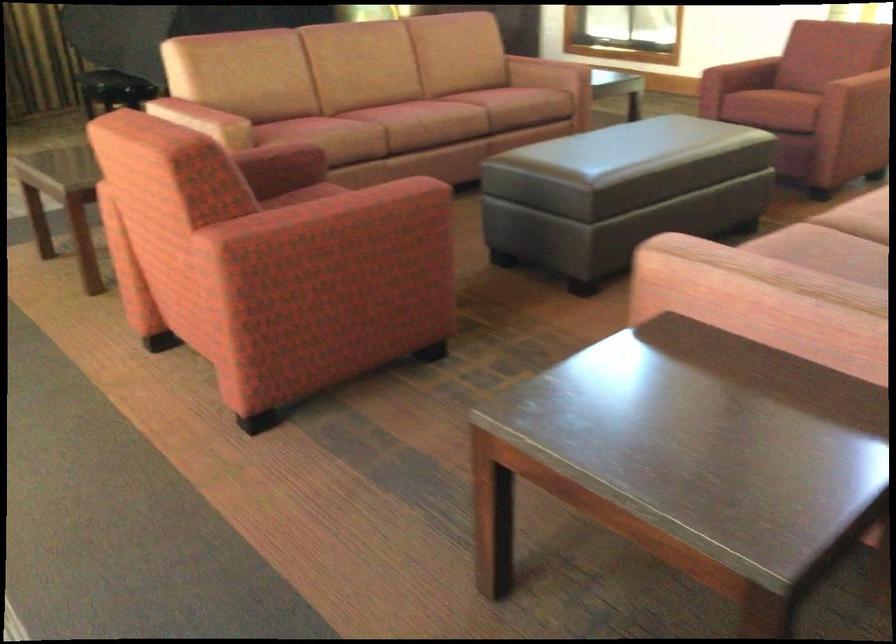
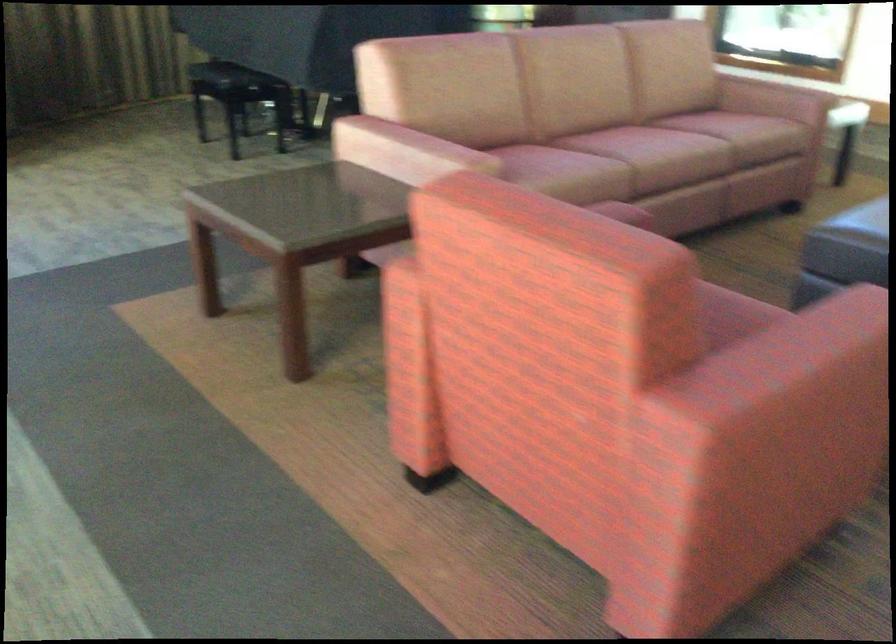
What movement of the cameraman would produce the second image?

The cameraman moved toward left, forward.